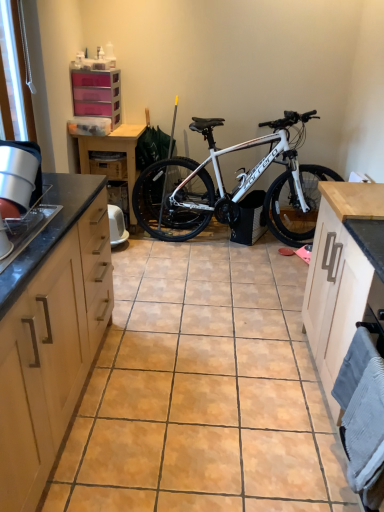
At what (x,y) coordinates should I click in order to perform the action: click on vacant space behind light wood cabinet at right, which is the second cabinetry from back to front. Please return your answer as a coordinate pair (x, y). Looking at the image, I should click on (268, 314).